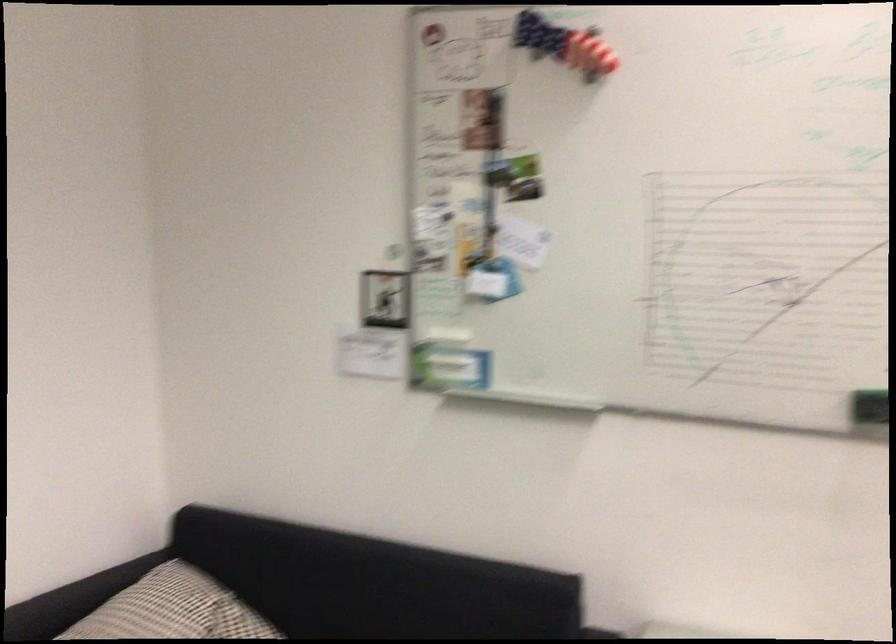
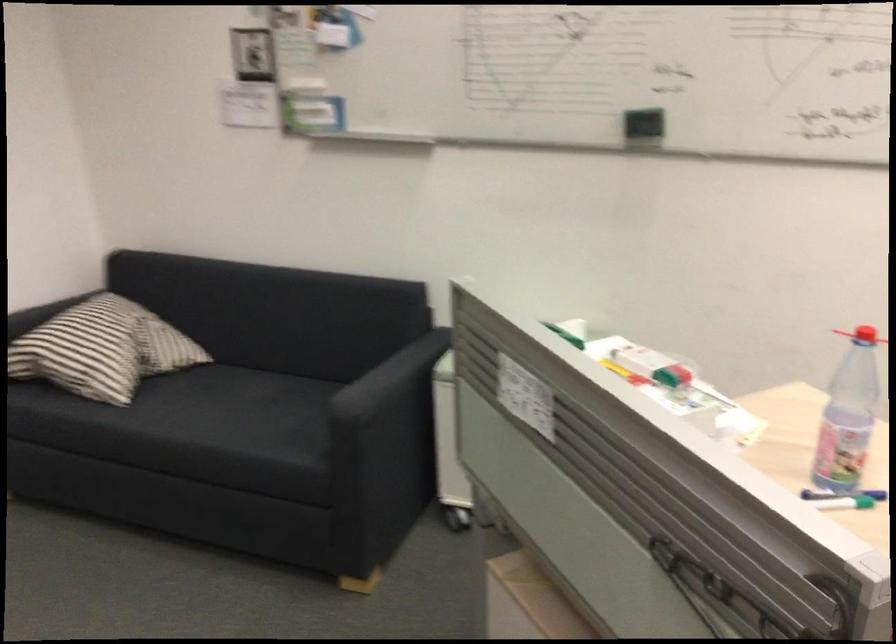
From the picture: Which direction would the cameraman need to move to produce the second image?

The movement direction of the cameraman is right, backward.